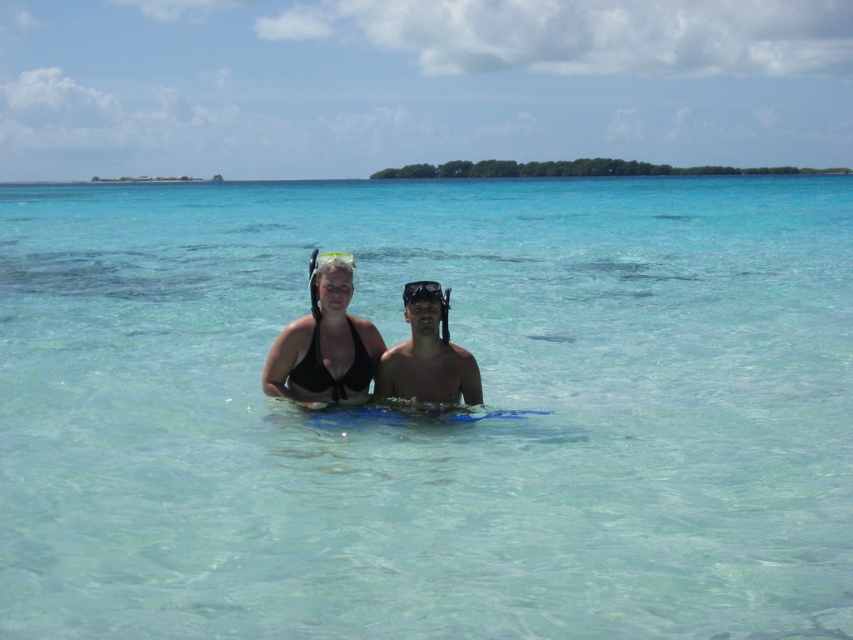
Question: Which point is closer to the camera?

Choices:
 (A) clear plastic goggles at upper center
 (B) transparent plastic goggles at center
 (C) clear water at center

Answer: (C)

Question: Which point appears farthest from the camera in this image?

Choices:
 (A) (428, 296)
 (B) (331, 394)

Answer: (B)

Question: Observing the image, what is the correct spatial positioning of clear water at center in reference to transparent plastic goggles at center?

Choices:
 (A) above
 (B) below

Answer: (A)

Question: Is clear water at center positioned behind clear plastic goggles at upper center?

Choices:
 (A) no
 (B) yes

Answer: (A)

Question: Can you confirm if clear water at center is wider than clear plastic goggles at upper center?

Choices:
 (A) yes
 (B) no

Answer: (A)

Question: Estimate the real-world distances between objects in this image. Which object is farther from the black matte bikini top at center?

Choices:
 (A) transparent plastic goggles at center
 (B) clear plastic goggles at upper center
 (C) clear water at center

Answer: (C)